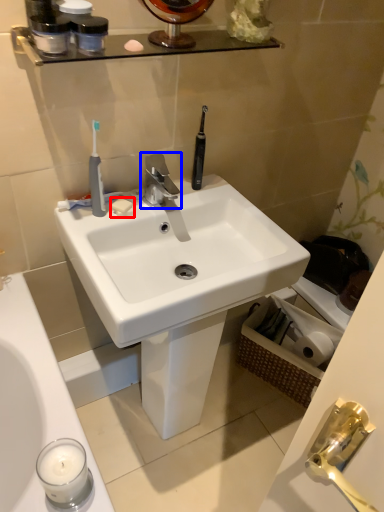
Question: Among these objects, which one is nearest to the camera, soap (highlighted by a red box) or tap (highlighted by a blue box)?

Choices:
 (A) soap
 (B) tap

Answer: (B)